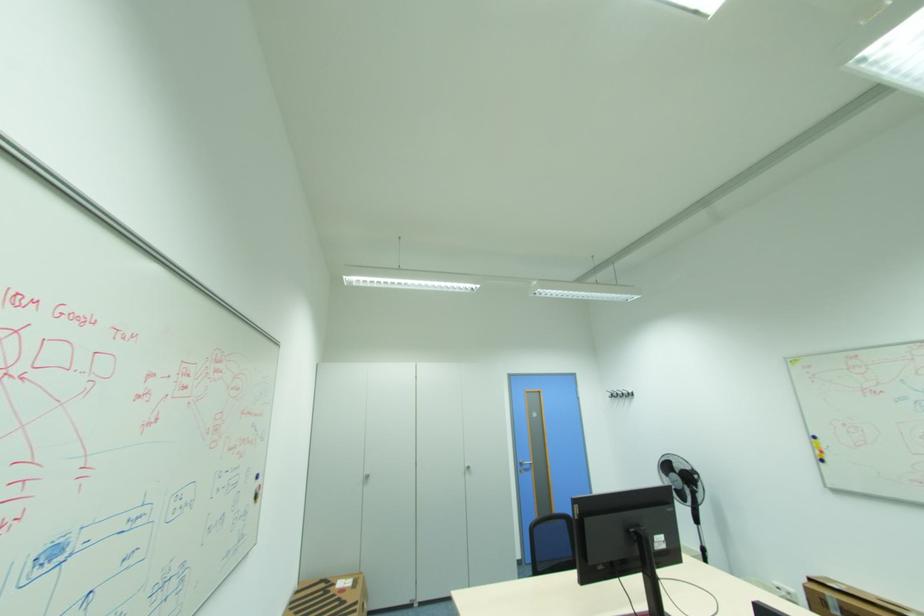
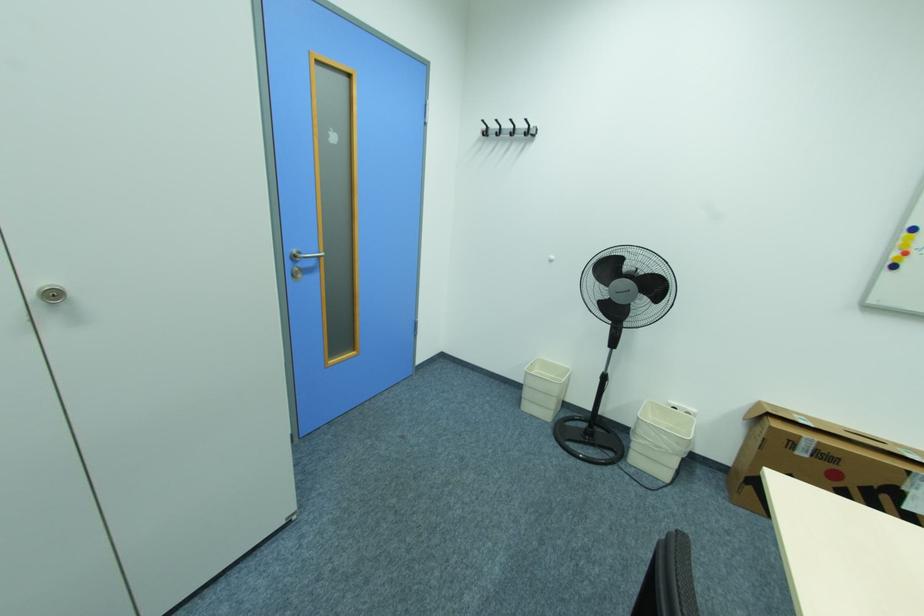
Where in the second image is the point corresponding to (617,395) from the first image?

(492, 132)